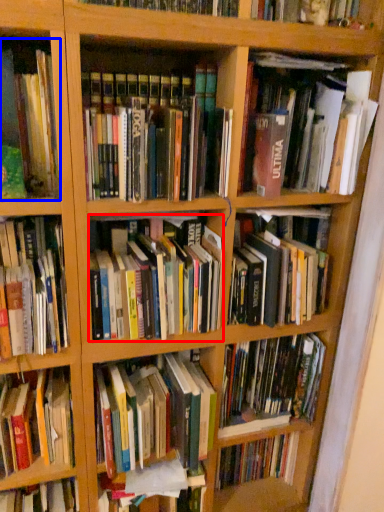
Question: Among these objects, which one is farthest to the camera, book (highlighted by a red box) or book (highlighted by a blue box)?

Choices:
 (A) book
 (B) book

Answer: (A)